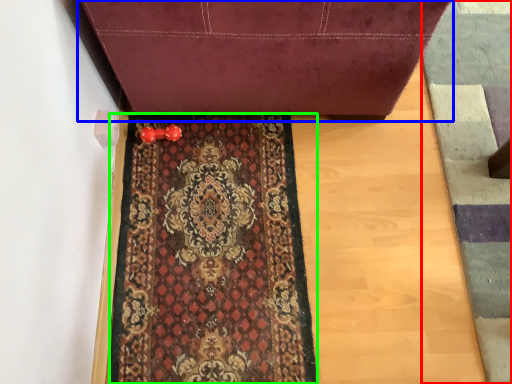
Question: Which object is the farthest from doormat (highlighted by a red box)? Choose among these: furniture (highlighted by a blue box) or mat (highlighted by a green box).

Choices:
 (A) furniture
 (B) mat

Answer: (B)